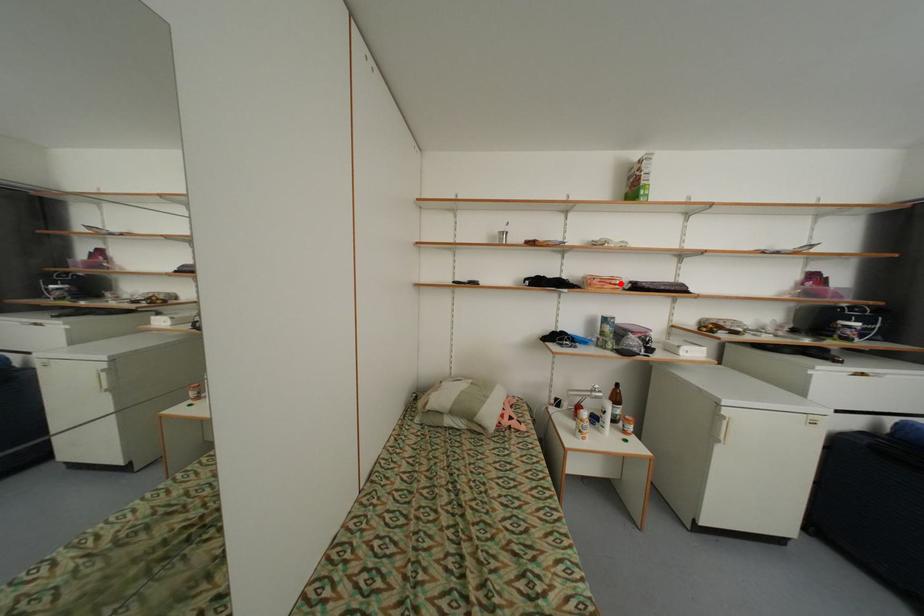
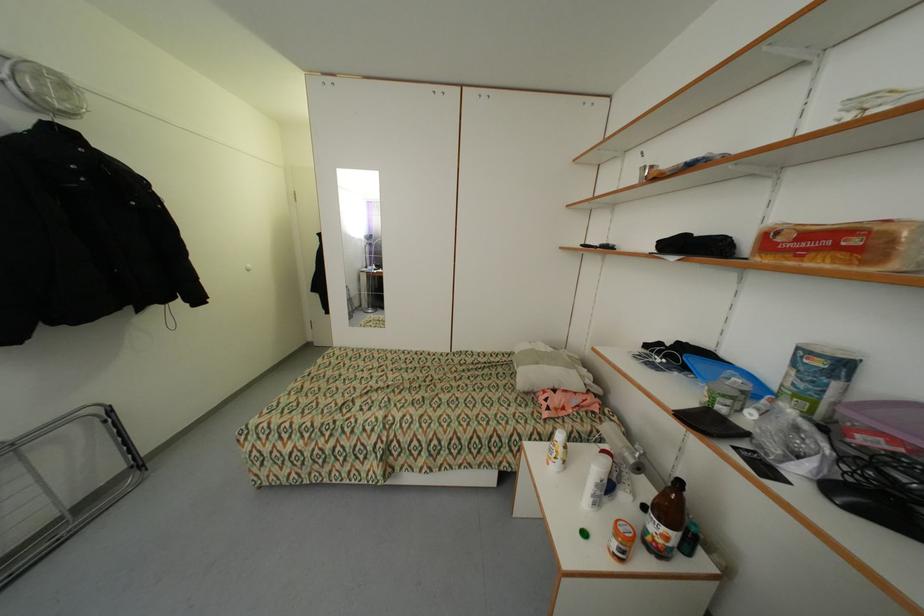
Locate, in the second image, the point that corresponds to the highlighted location in the first image.

(860, 241)